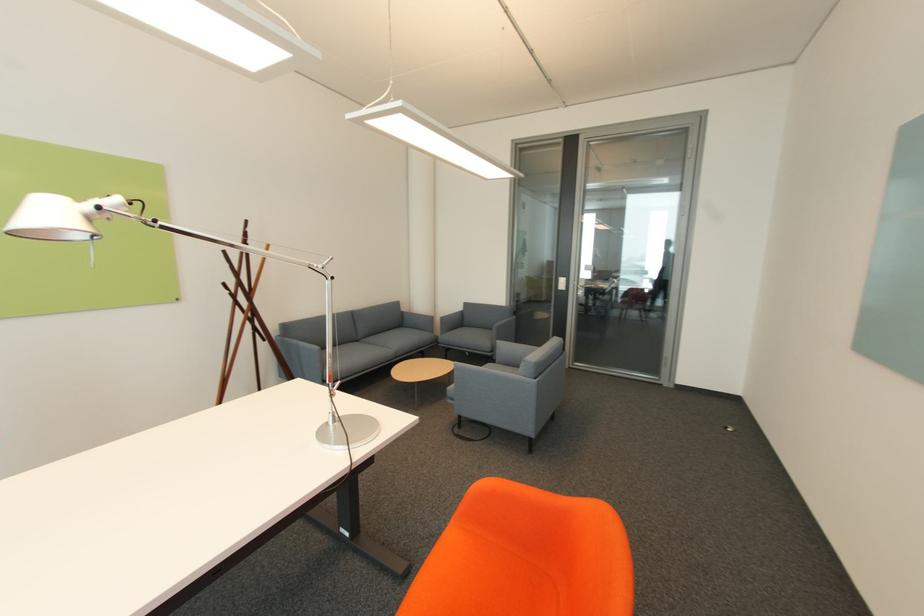
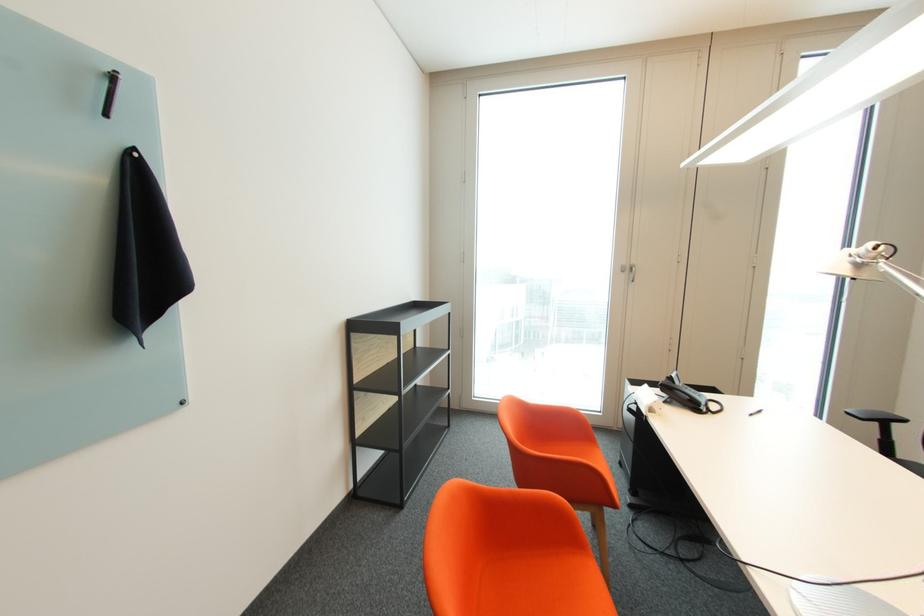
Find the pixel in the second image that matches the point at 106,208 in the first image.

(860, 256)